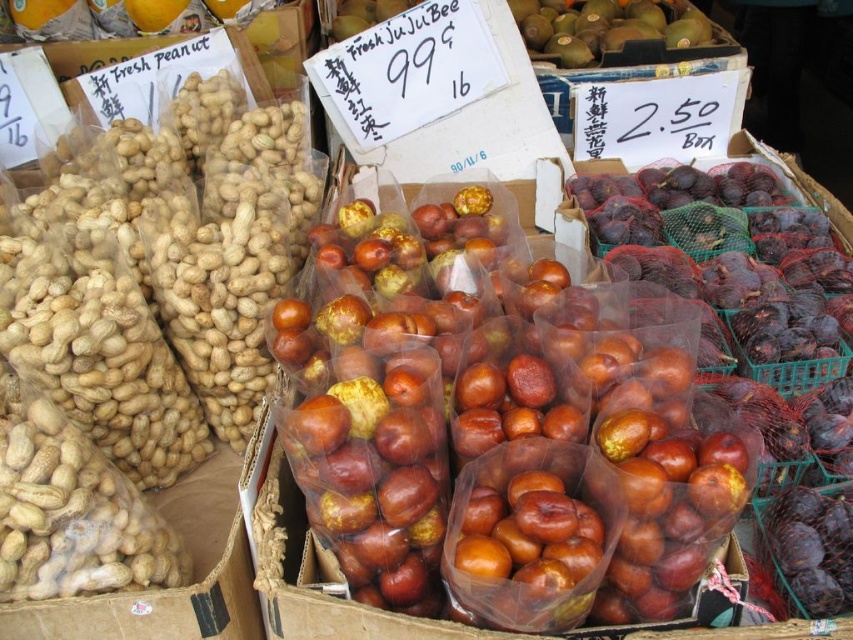
Who is lower down, shiny brown apples at center or green matte kiwi at upper center?

Positioned lower is shiny brown apples at center.

Is shiny brown apples at center above green matte kiwi at upper center?

Incorrect, shiny brown apples at center is not positioned above green matte kiwi at upper center.

Where is `shiny brown apples at center`? Image resolution: width=853 pixels, height=640 pixels. shiny brown apples at center is located at coordinates (579, 497).